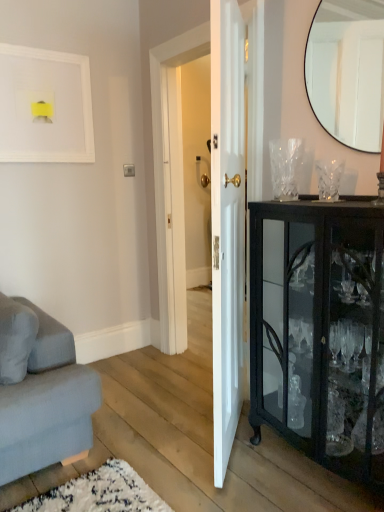
At what (x,y) coordinates should I click in order to perform the action: click on free spot to the left of black glass cabinet at right. Please return your answer as a coordinate pair (x, y). The width and height of the screenshot is (384, 512). Looking at the image, I should click on (204, 469).